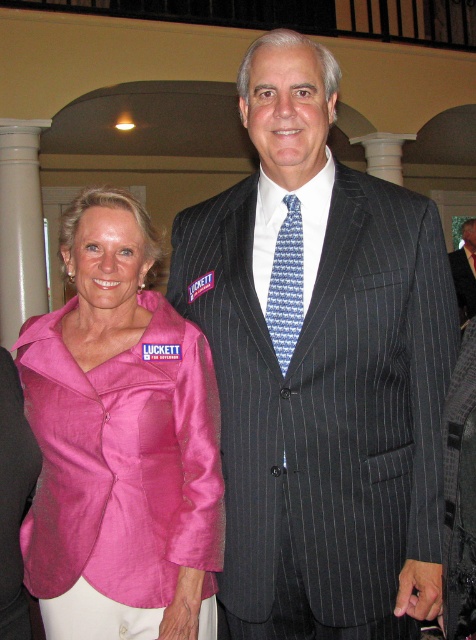
You are a photographer at the event and want to focus on the two points in the image. Which point, point (304,620) or point (467,288), is closer to you?

Point (304,620) is closer to the viewer than point (467,288).

You are organizing a photo shoot and need to ensure that the dark gray pinstripe suit at center and the pink satin blazer at left are visible in the frame. Given that the camera has a limited zoom range, which object should you prioritize keeping closer to the lens to ensure clarity?

The dark gray pinstripe suit at center is larger in size compared to the pink satin blazer at left, so prioritizing the pink satin blazer at left closer to the lens ensures both are equally visible within the limited zoom range.

You are organizing a photo shoot and need to ensure that the dark gray pinstripe suit at center and the pinstriped suit at center are visible in the frame. Given that the camera has a limited focus range, which suit should you prioritize to ensure it is in focus first?

The dark gray pinstripe suit at center has a smaller size compared to pinstriped suit at center, so you should prioritize focusing on the pinstriped suit at center first because it is larger and might be more prominent in the frame.